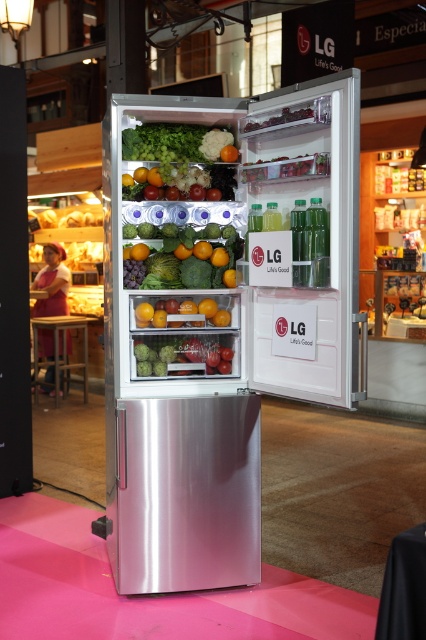
Question: Can you confirm if green matte cauliflower at upper center is thinner than green matte avocados at center?

Choices:
 (A) yes
 (B) no

Answer: (A)

Question: Which of these objects is positioned closest to the green matte cauliflower at upper center?

Choices:
 (A) smooth orange at center
 (B) green matte avocados at center

Answer: (B)

Question: Is green matte avocados at center to the right of smooth orange at center from the viewer's perspective?

Choices:
 (A) no
 (B) yes

Answer: (A)

Question: Which point appears closest to the camera in this image?

Choices:
 (A) coord(186,284)
 (B) coord(158,186)
 (C) coord(161,168)

Answer: (C)

Question: Can you confirm if green matte cauliflower at upper center is wider than green matte avocados at center?

Choices:
 (A) no
 (B) yes

Answer: (A)

Question: Among these points, which one is farthest from the camera?

Choices:
 (A) (158, 285)
 (B) (146, 316)
 (C) (173, 124)

Answer: (C)